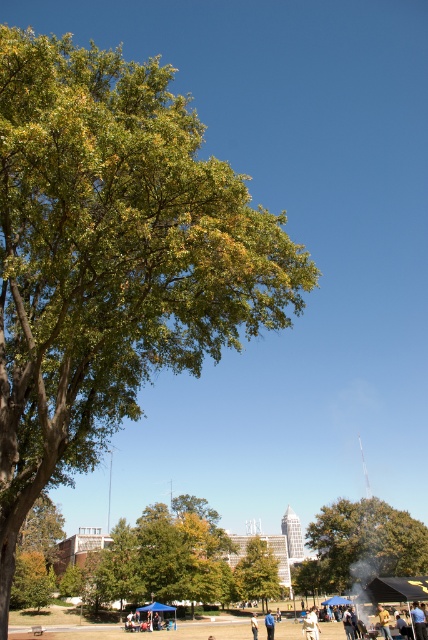
Question: Is green matte tree at center in front of yellow fabric at lower center?

Choices:
 (A) yes
 (B) no

Answer: (B)

Question: Among these points, which one is nearest to the camera?

Choices:
 (A) (306, 573)
 (B) (249, 593)

Answer: (B)

Question: Based on their relative distances, which object is farther from the green leafy tree at lower right?

Choices:
 (A) green matte tree at center
 (B) blue fabric umbrella at center

Answer: (B)

Question: Considering the real-world distances, which object is closest to the green leafy tree at lower right?

Choices:
 (A) blue fabric umbrella at center
 (B) green leafy tree at upper left
 (C) light brown leather jacket at center

Answer: (A)

Question: Can you confirm if green leafy tree at upper left is positioned above green leafy tree at lower right?

Choices:
 (A) no
 (B) yes

Answer: (B)

Question: Is green leafy tree at lower right to the right of yellow fabric at lower center from the viewer's perspective?

Choices:
 (A) yes
 (B) no

Answer: (A)